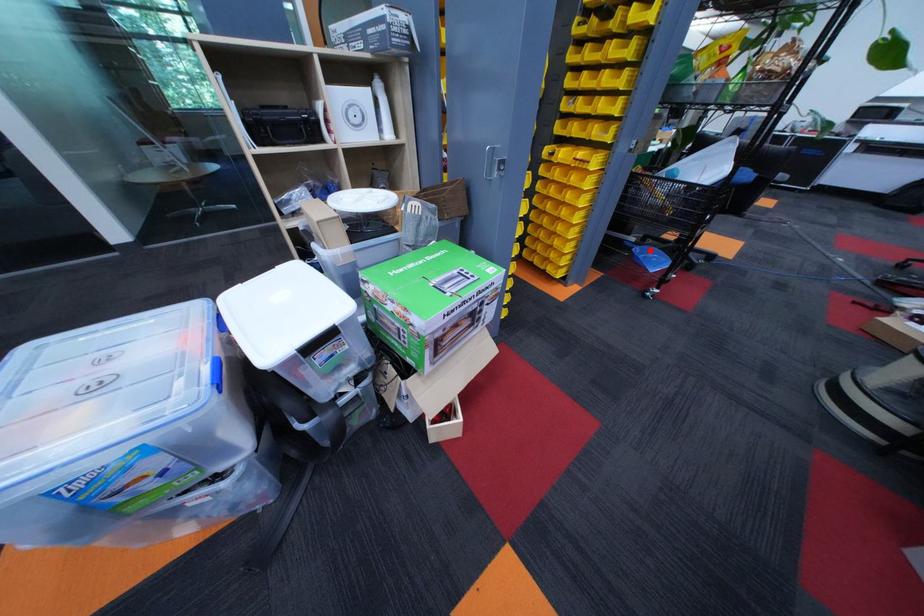
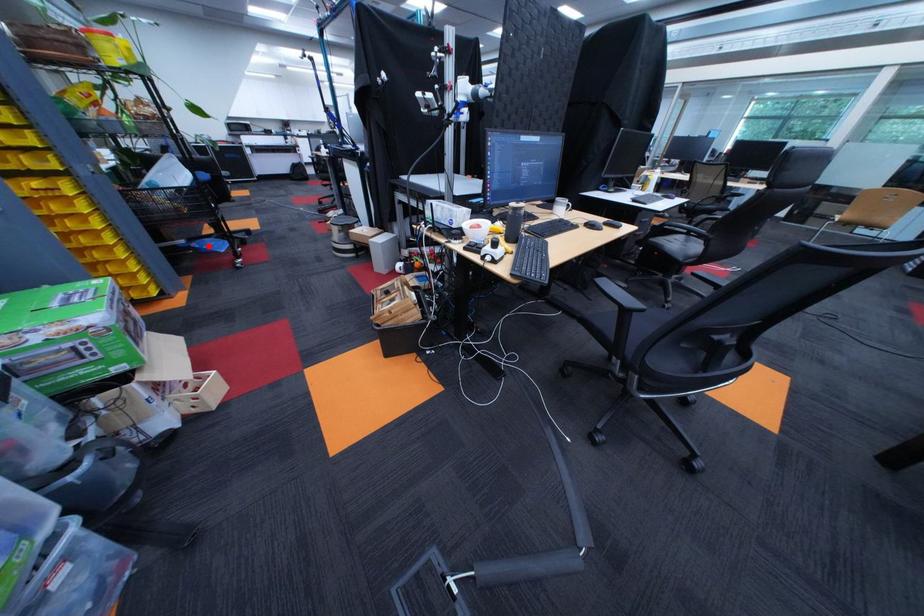
I am providing you with two images of the same scene from different viewpoints. A red point is marked on the first image and another point is marked on the second image. Do the highlighted points in image1 and image2 indicate the same real-world spot?

Yes